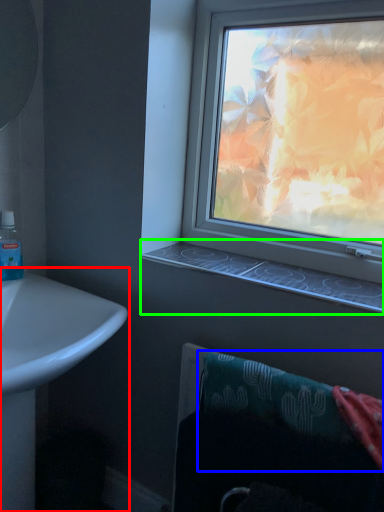
Question: Based on their relative distances, which object is nearer to sink (highlighted by a red box)? Choose from bath towel (highlighted by a blue box) and window sill (highlighted by a green box).

Choices:
 (A) bath towel
 (B) window sill

Answer: (B)